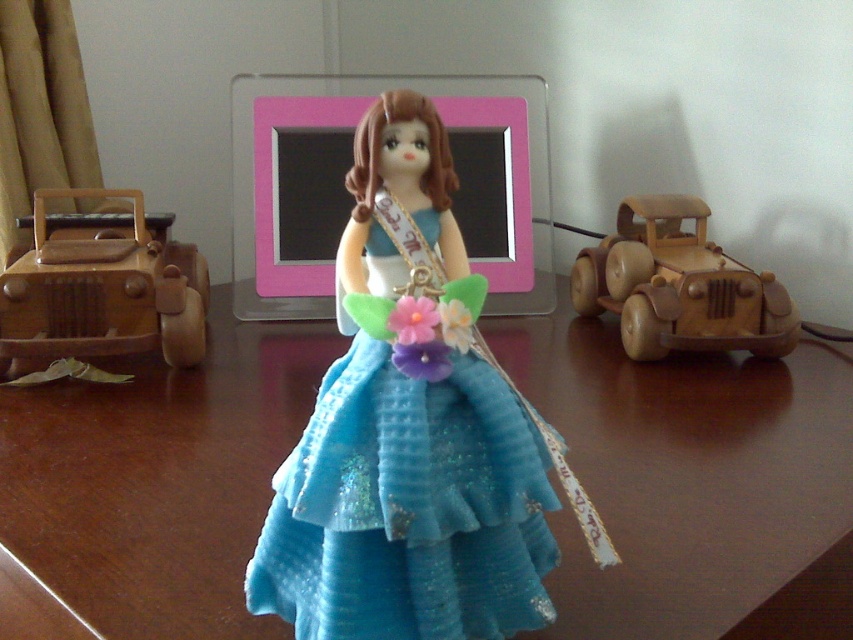
You are trying to place a small figurine on the wooden table at center. According to the coordinates provided, where exactly should you place it?

The wooden table at center is located at point (694, 483), so you should place the figurine there.

You are arranging items on a table and see the wooden table at center and the glittery blue fabric dress at center. Which object is located to the right of the other?

The wooden table at center is positioned on the right side of glittery blue fabric dress at center, so the wooden table at center is to the right of the glittery blue fabric dress at center.